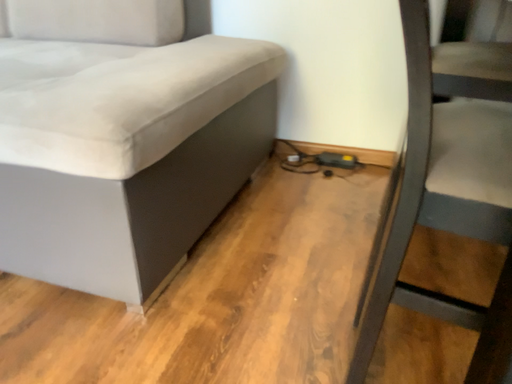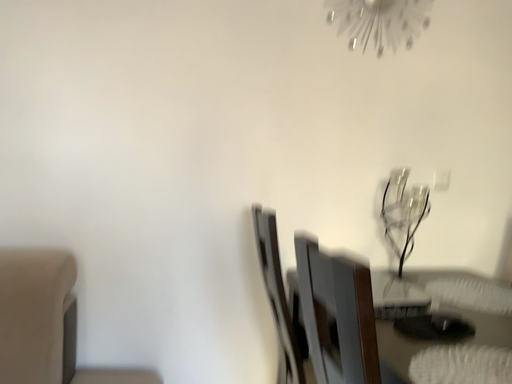
Question: Which way did the camera rotate in the video?

Choices:
 (A) rotated left
 (B) rotated right

Answer: (B)